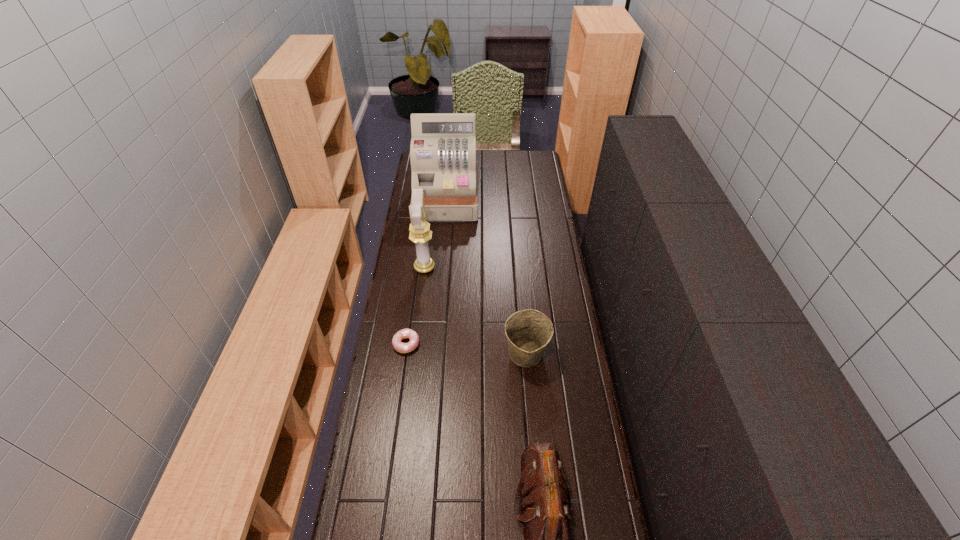
Where is `object that can be found as the fourth closest to the cash register`? object that can be found as the fourth closest to the cash register is located at coordinates (543, 498).

Find the location of a particular element. free location that satisfies the following two spatial constraints: 1. on the operating side of the wine bucket; 2. on the left side of the farthest object is located at coordinates pyautogui.click(x=433, y=354).

Image resolution: width=960 pixels, height=540 pixels. What are the coordinates of `free spot that satisfies the following two spatial constraints: 1. on the operating side of the farthest object; 2. on the front-facing side of the award` in the screenshot? It's located at (441, 267).

The height and width of the screenshot is (540, 960). What are the coordinates of `vacant space that satisfies the following two spatial constraints: 1. on the front-facing side of the second farthest object; 2. on the right side of the wine bucket` in the screenshot? It's located at click(414, 354).

Where is `free space that satisfies the following two spatial constraints: 1. on the front-facing side of the fourth nearest object; 2. on the back side of the wine bucket`? free space that satisfies the following two spatial constraints: 1. on the front-facing side of the fourth nearest object; 2. on the back side of the wine bucket is located at coordinates (414, 354).